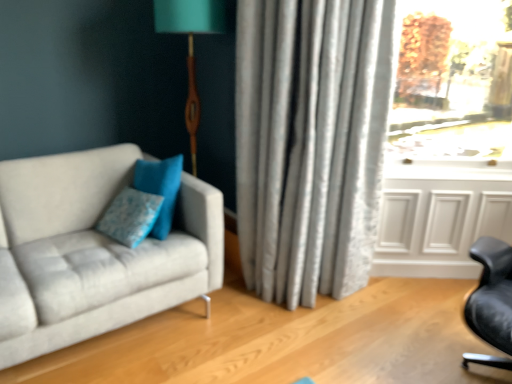
The height and width of the screenshot is (384, 512). What do you see at coordinates (311, 142) in the screenshot?
I see `silky gray curtain at center` at bounding box center [311, 142].

Measure the distance between point (143, 212) and camera.

1.98 meters.

What do you see at coordinates (439, 225) in the screenshot?
I see `white paneling at lower right` at bounding box center [439, 225].

Where is `suede gray couch at left`? suede gray couch at left is located at coordinates (93, 252).

Is white paneling at lower right in contact with silky gray curtain at center?

No, white paneling at lower right is not with silky gray curtain at center.

Which is in front, white paneling at lower right or silky gray curtain at center?

Positioned in front is silky gray curtain at center.

From the image's perspective, is transparent glass window at upper right on top of blue fabric pillow at center?

Yes, from the image's perspective, transparent glass window at upper right is on top of blue fabric pillow at center.

Can you tell me how much transparent glass window at upper right and blue fabric pillow at center differ in facing direction?

36.1 degrees separate the facing orientations of transparent glass window at upper right and blue fabric pillow at center.

Are transparent glass window at upper right and blue fabric pillow at center making contact?

No, transparent glass window at upper right is not next to blue fabric pillow at center.

Is transparent glass window at upper right wider than blue fabric pillow at center?

Correct, the width of transparent glass window at upper right exceeds that of blue fabric pillow at center.

Is suede gray couch at left located within white paneling at lower right?

No, suede gray couch at left is not a part of white paneling at lower right.

Which object is more forward, white paneling at lower right or suede gray couch at left?

Positioned in front is suede gray couch at left.

Can you confirm if white paneling at lower right is smaller than suede gray couch at left?

Correct, white paneling at lower right occupies less space than suede gray couch at left.

Is point (394, 212) farther from camera compared to point (219, 222)?

That is True.

Is silky gray curtain at center inside the boundaries of transparent glass window at upper right, or outside?

silky gray curtain at center lies outside transparent glass window at upper right.

From a real-world perspective, which is physically below, silky gray curtain at center or transparent glass window at upper right?

silky gray curtain at center, from a real-world perspective.

Considering the relative sizes of silky gray curtain at center and transparent glass window at upper right in the image provided, is silky gray curtain at center bigger than transparent glass window at upper right?

Correct, silky gray curtain at center is larger in size than transparent glass window at upper right.

Can you tell me how much silky gray curtain at center and transparent glass window at upper right differ in facing direction?

They differ by 13.3 degrees in their facing directions.

Considering the positions of objects transparent glass window at upper right and suede gray couch at left in the image provided, who is more to the left, transparent glass window at upper right or suede gray couch at left?

From the viewer's perspective, suede gray couch at left appears more on the left side.

How different are the orientations of transparent glass window at upper right and suede gray couch at left in degrees?

The angle between the facing direction of transparent glass window at upper right and the facing direction of suede gray couch at left is 37.2 degrees.

Is transparent glass window at upper right positioned with its back to suede gray couch at left?

No, transparent glass window at upper right is not facing the opposite direction of suede gray couch at left.

Is suede gray couch at left next to silky gray curtain at center and touching it?

No, suede gray couch at left is not in contact with silky gray curtain at center.

Is silky gray curtain at center at the back of suede gray couch at left?

No, suede gray couch at left is not facing away from silky gray curtain at center.

Which of these two, suede gray couch at left or silky gray curtain at center, stands taller?

With more height is silky gray curtain at center.

Which is behind, point (147, 284) or point (345, 47)?

The point (345, 47) is farther from the camera.

Considering the relative sizes of blue fabric pillow at center and silky gray curtain at center in the image provided, is blue fabric pillow at center bigger than silky gray curtain at center?

No, blue fabric pillow at center is not bigger than silky gray curtain at center.

Which object is thinner, blue fabric pillow at center or silky gray curtain at center?

blue fabric pillow at center.

How far apart are blue fabric pillow at center and silky gray curtain at center?

blue fabric pillow at center and silky gray curtain at center are 29.22 inches apart.

From the image's perspective, who appears lower, blue fabric pillow at center or silky gray curtain at center?

From the image's view, blue fabric pillow at center is below.

Identify the location of curtain on the left of white paneling at lower right. This screenshot has width=512, height=384. (311, 142).

Identify the location of window above the blue fabric pillow at center (from a real-world perspective). (453, 86).

From the image, which object appears to be nearer to blue fabric pillow at center, transparent glass window at upper right or silky gray curtain at center?

Among the two, silky gray curtain at center is located nearer to blue fabric pillow at center.

Looking at the image, which one is located closer to transparent glass window at upper right, white paneling at lower right or suede gray couch at left?

Among the two, white paneling at lower right is located nearer to transparent glass window at upper right.

Which object lies nearer to the anchor point white paneling at lower right, silky gray curtain at center or transparent glass window at upper right?

silky gray curtain at center.

From the image, which object appears to be farther from silky gray curtain at center, blue fabric pillow at center or suede gray couch at left?

Based on the image, blue fabric pillow at center appears to be further to silky gray curtain at center.

Looking at the image, which one is located further to white paneling at lower right, silky gray curtain at center or blue fabric pillow at center?

blue fabric pillow at center is positioned further to the anchor white paneling at lower right.

When comparing their distances from transparent glass window at upper right, does white paneling at lower right or silky gray curtain at center seem further?

silky gray curtain at center is further to transparent glass window at upper right.

Based on their spatial positions, is suede gray couch at left or white paneling at lower right closer to silky gray curtain at center?

Based on the image, white paneling at lower right appears to be nearer to silky gray curtain at center.

Based on their spatial positions, is transparent glass window at upper right or white paneling at lower right closer to blue fabric pillow at center?

white paneling at lower right.

Where is `window between suede gray couch at left and white paneling at lower right from left to right`? The width and height of the screenshot is (512, 384). window between suede gray couch at left and white paneling at lower right from left to right is located at coordinates (453, 86).

Image resolution: width=512 pixels, height=384 pixels. I want to click on pillow located between suede gray couch at left and silky gray curtain at center in the left-right direction, so click(130, 216).

Find the location of `curtain situated between blue fabric pillow at center and transparent glass window at upper right from left to right`. curtain situated between blue fabric pillow at center and transparent glass window at upper right from left to right is located at coordinates (311, 142).

Image resolution: width=512 pixels, height=384 pixels. In order to click on curtain between suede gray couch at left and white paneling at lower right in the horizontal direction in this screenshot , I will do `click(311, 142)`.